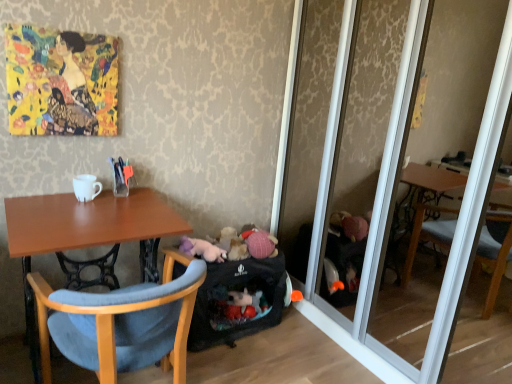
Question: From the image's perspective, is black fabric baby carriage at lower center located beneath white glossy mug at upper left?

Choices:
 (A) no
 (B) yes

Answer: (B)

Question: From a real-world perspective, is black fabric baby carriage at lower center located beneath white glossy mug at upper left?

Choices:
 (A) no
 (B) yes

Answer: (B)

Question: Does black fabric baby carriage at lower center have a greater width compared to white glossy mug at upper left?

Choices:
 (A) yes
 (B) no

Answer: (A)

Question: Is black fabric baby carriage at lower center positioned beyond the bounds of white glossy mug at upper left?

Choices:
 (A) yes
 (B) no

Answer: (A)

Question: Considering the relative sizes of black fabric baby carriage at lower center and white glossy mug at upper left in the image provided, is black fabric baby carriage at lower center smaller than white glossy mug at upper left?

Choices:
 (A) yes
 (B) no

Answer: (B)

Question: Is black fabric baby carriage at lower center at the left side of white glossy mug at upper left?

Choices:
 (A) no
 (B) yes

Answer: (A)

Question: Does fluffy white stuffed animal at lower center have a lesser height compared to fluffy plush toys at center?

Choices:
 (A) no
 (B) yes

Answer: (B)

Question: Is fluffy white stuffed animal at lower center directly adjacent to fluffy plush toys at center?

Choices:
 (A) yes
 (B) no

Answer: (B)

Question: From the image's perspective, would you say fluffy white stuffed animal at lower center is shown under fluffy plush toys at center?

Choices:
 (A) yes
 (B) no

Answer: (A)

Question: Considering the relative positions of fluffy white stuffed animal at lower center and fluffy plush toys at center in the image provided, is fluffy white stuffed animal at lower center behind fluffy plush toys at center?

Choices:
 (A) yes
 (B) no

Answer: (B)

Question: Is fluffy white stuffed animal at lower center positioned far away from fluffy plush toys at center?

Choices:
 (A) no
 (B) yes

Answer: (A)

Question: Is fluffy white stuffed animal at lower center bigger than fluffy plush toys at center?

Choices:
 (A) yes
 (B) no

Answer: (A)

Question: Does black fabric baby carriage at lower center have a larger size compared to fluffy white stuffed animal at lower center?

Choices:
 (A) yes
 (B) no

Answer: (A)